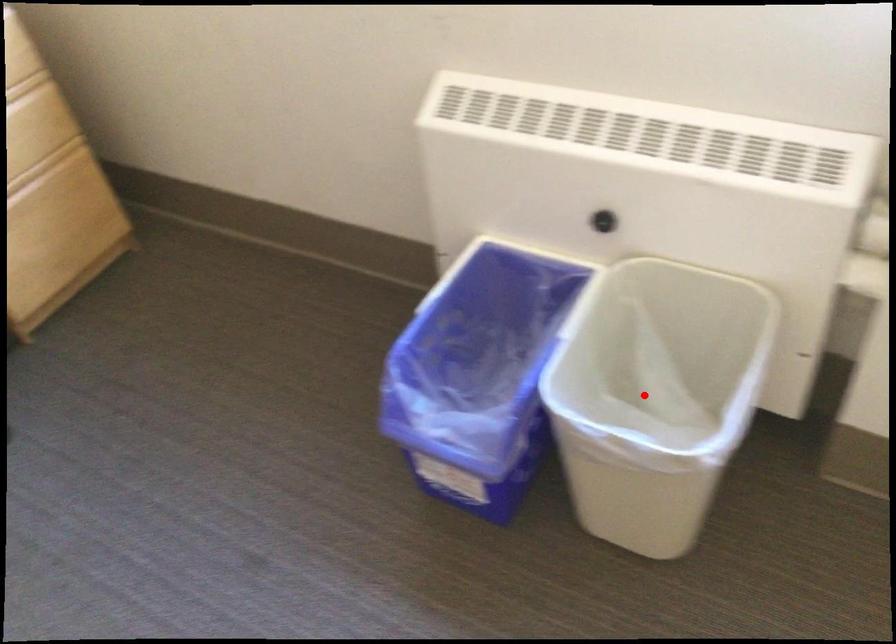
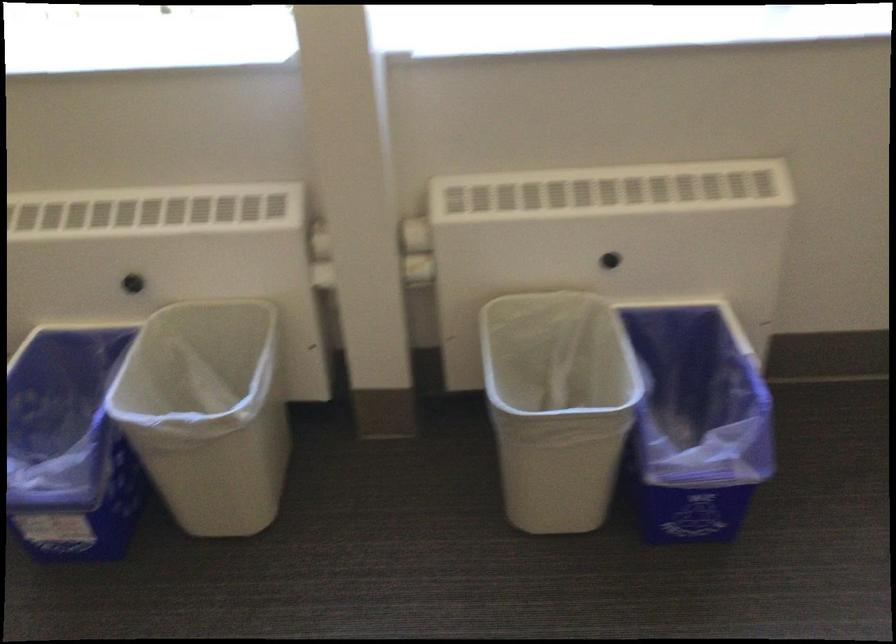
Where in the second image is the point corresponding to the highlighted location from the first image?

(208, 413)